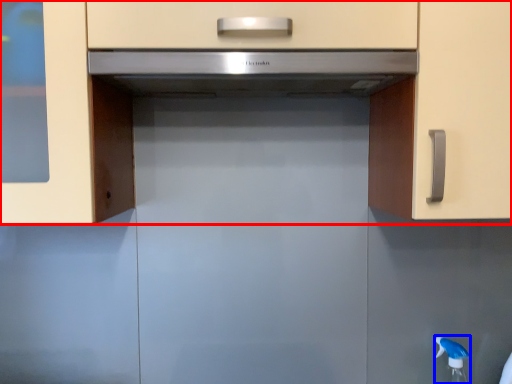
Question: Which object is closer to the camera taking this photo, cabinetry (highlighted by a red box) or faucet (highlighted by a blue box)?

Choices:
 (A) cabinetry
 (B) faucet

Answer: (A)